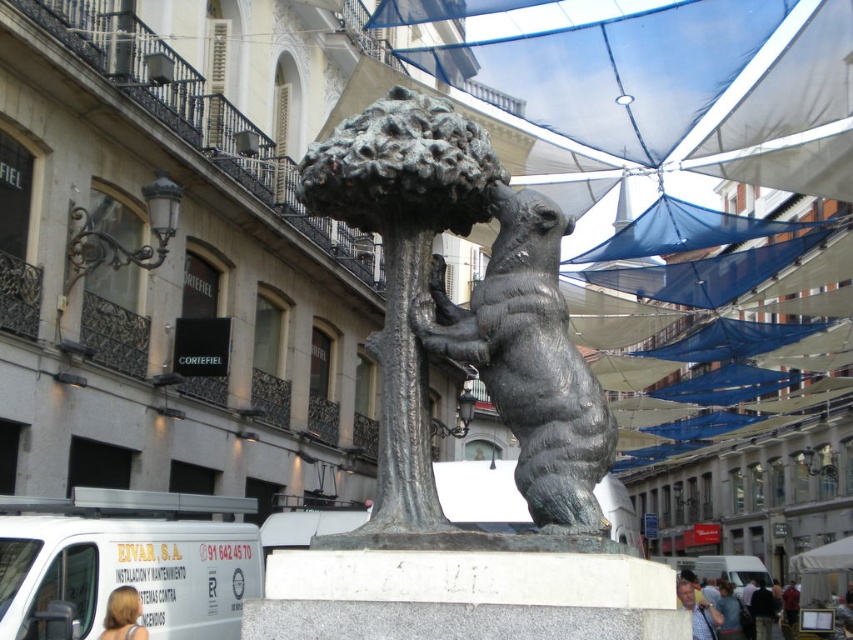
Question: Is bronze bear at center closer to camera compared to polished bronze bear at center?

Choices:
 (A) yes
 (B) no

Answer: (A)

Question: Is bronze bear at center positioned behind polished bronze bear at center?

Choices:
 (A) yes
 (B) no

Answer: (B)

Question: Is bronze bear at center wider than polished bronze bear at center?

Choices:
 (A) no
 (B) yes

Answer: (B)

Question: Which object is closer to the camera taking this photo?

Choices:
 (A) polished bronze bear at center
 (B) bronze bear at center

Answer: (B)